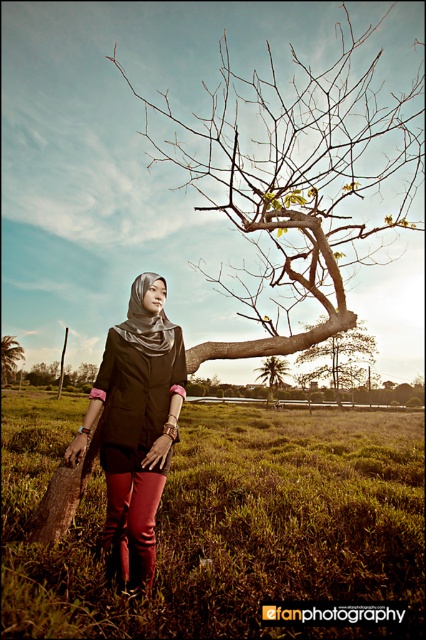
You are a photographer planning to take a picture of the brown textured tree at center and the brown wood tree at left. Which tree should you focus on if you want to capture the tallest tree in the scene?

The brown textured tree at center is much taller than the brown wood tree at left, so you should focus on the brown textured tree at center to capture the tallest tree in the scene.

You are a photographer planning to capture a portrait of the person leaning against the tree. Which tree should you position the person closer to for the best framing, the brown textured tree at center or the brown wood tree at left?

The brown textured tree at center has a larger size compared to the brown wood tree at left, so positioning the person closer to the brown textured tree at center would provide a better frame due to its larger size.